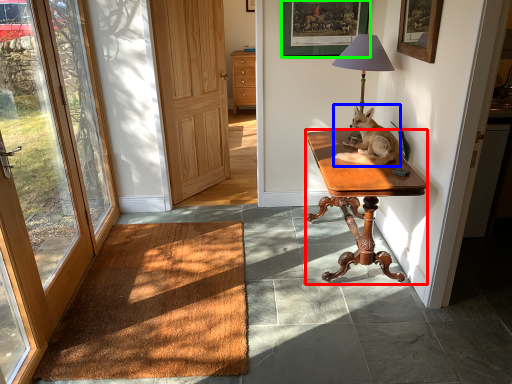
Question: Estimate the real-world distances between objects in this image. Which object is farther from desk (highlighted by a red box), dog (highlighted by a blue box) or picture frame (highlighted by a green box)?

Choices:
 (A) dog
 (B) picture frame

Answer: (B)